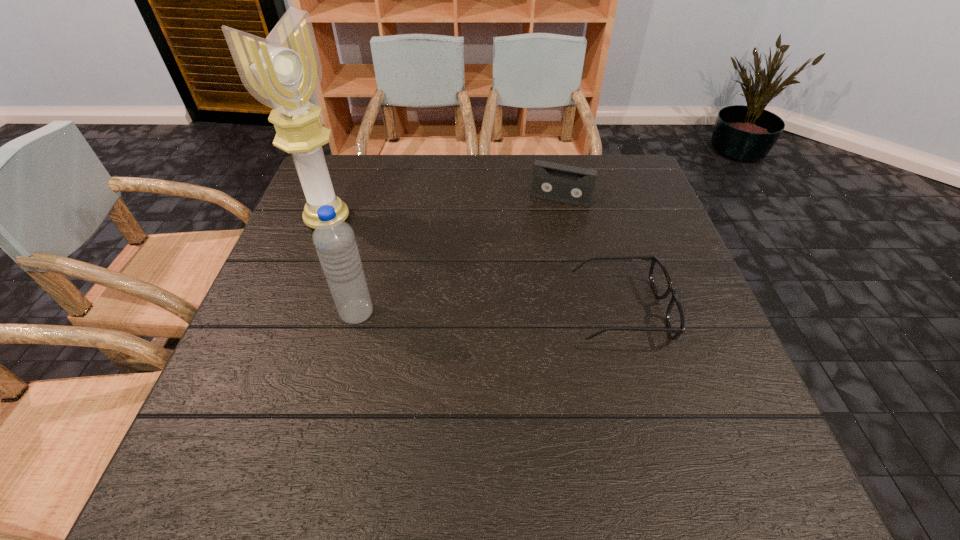
Find the location of a particular element. free spot at the far left corner of the desktop is located at coordinates coord(360,159).

At what (x,y) coordinates should I click in order to perform the action: click on free space at the near right corner. Please return your answer as a coordinate pair (x, y). This screenshot has height=540, width=960. Looking at the image, I should click on (701, 407).

Locate an element on the screen. free space between the third shortest object and the shortest object is located at coordinates (489, 312).

This screenshot has width=960, height=540. Find the location of `vacant area that lies between the shortest object and the tallest object`. vacant area that lies between the shortest object and the tallest object is located at coordinates (474, 265).

Where is `empty location between the third tallest object and the spectacles`? The image size is (960, 540). empty location between the third tallest object and the spectacles is located at coordinates (591, 254).

Where is `vacant space that is in between the spectacles and the tallest object`? This screenshot has width=960, height=540. vacant space that is in between the spectacles and the tallest object is located at coordinates (474, 265).

At what (x,y) coordinates should I click in order to perform the action: click on free point between the videotape and the tallest object. Please return your answer as a coordinate pair (x, y). The image size is (960, 540). Looking at the image, I should click on (444, 210).

At what (x,y) coordinates should I click in order to perform the action: click on unoccupied position between the award and the videotape. Please return your answer as a coordinate pair (x, y). This screenshot has height=540, width=960. Looking at the image, I should click on (444, 210).

At what (x,y) coordinates should I click in order to perform the action: click on free space that is in between the award and the videotape. Please return your answer as a coordinate pair (x, y). Image resolution: width=960 pixels, height=540 pixels. Looking at the image, I should click on (444, 210).

At what (x,y) coordinates should I click in order to perform the action: click on empty location between the shortest object and the leftmost object. Please return your answer as a coordinate pair (x, y). Looking at the image, I should click on (474, 265).